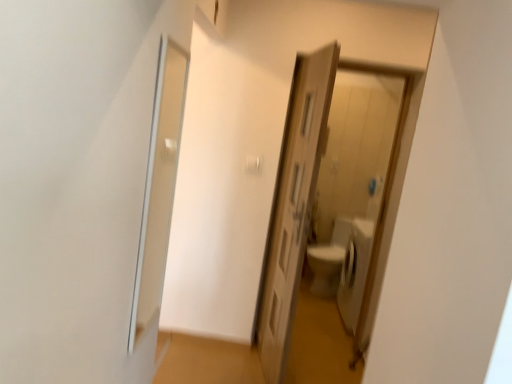
Question: Is wooden door at center spatially inside brown wooden door at center, the first path when ordered from front to back, or outside of it?

Choices:
 (A) inside
 (B) outside

Answer: (B)

Question: Visually, is wooden door at center positioned to the left or to the right of brown wooden door at center, the first path when ordered from front to back?

Choices:
 (A) left
 (B) right

Answer: (B)

Question: Which of these objects is positioned closest to the brown wooden door at center, the first path when ordered from front to back?

Choices:
 (A) wooden door at center
 (B) transparent glass screen door at left
 (C) white glossy toilet at center, marked as the second path in a front-to-back arrangement

Answer: (C)

Question: Considering the real-world distances, which object is farthest from the white glossy toilet at center, acting as the 1th path starting from the back?

Choices:
 (A) brown wooden door at center, which is the second path from back to front
 (B) transparent glass screen door at left
 (C) wooden door at center

Answer: (B)